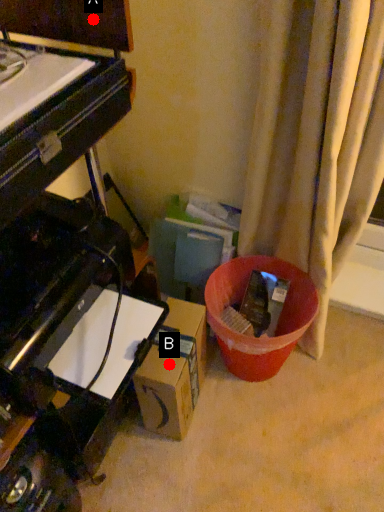
Question: Two points are circled on the image, labeled by A and B beside each circle. Which point is closer to the camera?

Choices:
 (A) A is closer
 (B) B is closer

Answer: (A)